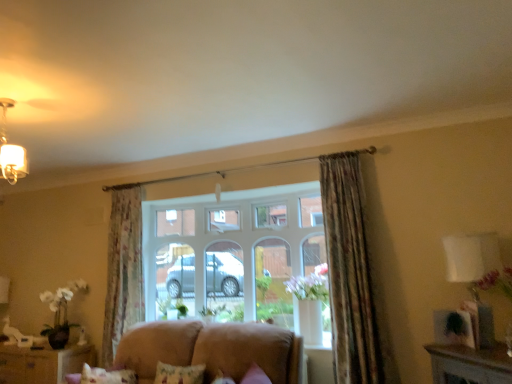
Question: Is the depth of white fabric lampshade at right less than that of brown wooden cabinet at lower left?

Choices:
 (A) no
 (B) yes

Answer: (B)

Question: Does white fabric lampshade at right have a larger size compared to brown wooden cabinet at lower left?

Choices:
 (A) yes
 (B) no

Answer: (B)

Question: From the image's perspective, is white fabric lampshade at right located beneath brown wooden cabinet at lower left?

Choices:
 (A) no
 (B) yes

Answer: (A)

Question: Is white fabric lampshade at right taller than brown wooden cabinet at lower left?

Choices:
 (A) yes
 (B) no

Answer: (A)

Question: Is brown wooden cabinet at lower left at the back of white fabric lampshade at right?

Choices:
 (A) no
 (B) yes

Answer: (A)

Question: From a real-world perspective, is white fabric lampshade at right physically below brown wooden cabinet at lower left?

Choices:
 (A) yes
 (B) no

Answer: (B)

Question: Is floral fabric curtain at upper right, the second curtain in the back-to-front sequence, closer to the viewer compared to suede-like beige sofa at lower center?

Choices:
 (A) yes
 (B) no

Answer: (B)

Question: Is floral fabric curtain at upper right, placed as the second curtain when sorted from left to right, thinner than suede-like beige sofa at lower center?

Choices:
 (A) yes
 (B) no

Answer: (A)

Question: Is suede-like beige sofa at lower center completely or partially inside floral fabric curtain at upper right, placed as the second curtain when sorted from left to right?

Choices:
 (A) no
 (B) yes

Answer: (A)

Question: From the image's perspective, is floral fabric curtain at upper right, the second curtain in the back-to-front sequence, on top of suede-like beige sofa at lower center?

Choices:
 (A) no
 (B) yes

Answer: (B)

Question: Is floral fabric curtain at upper right, marked as the first curtain in a front-to-back arrangement, oriented towards suede-like beige sofa at lower center?

Choices:
 (A) yes
 (B) no

Answer: (B)

Question: Is floral fabric curtain at upper right, placed as the second curtain when sorted from left to right, wider than suede-like beige sofa at lower center?

Choices:
 (A) yes
 (B) no

Answer: (B)

Question: Does brown wooden cabinet at lower left come behind floral fabric curtain at left, the 1th curtain positioned from the left?

Choices:
 (A) no
 (B) yes

Answer: (B)